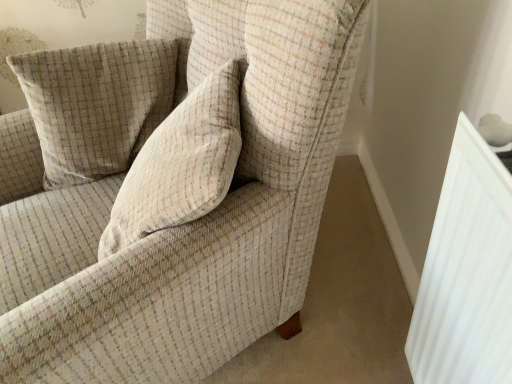
Question: Is beige textured cushion at upper left at the right side of white ribbed radiator at right?

Choices:
 (A) no
 (B) yes

Answer: (A)

Question: From the image's perspective, would you say beige textured cushion at upper left is positioned over white ribbed radiator at right?

Choices:
 (A) yes
 (B) no

Answer: (A)

Question: From the image's perspective, would you say beige textured cushion at upper left is shown under white ribbed radiator at right?

Choices:
 (A) no
 (B) yes

Answer: (A)

Question: Is beige textured cushion at upper left far away from white ribbed radiator at right?

Choices:
 (A) no
 (B) yes

Answer: (A)

Question: Considering the relative positions of beige textured cushion at upper left and white ribbed radiator at right in the image provided, is beige textured cushion at upper left to the left of white ribbed radiator at right from the viewer's perspective?

Choices:
 (A) yes
 (B) no

Answer: (A)

Question: Is beige textured cushion at upper left smaller than white ribbed radiator at right?

Choices:
 (A) no
 (B) yes

Answer: (A)

Question: From a real-world perspective, is white ribbed radiator at right beneath beige textured cushion at upper left?

Choices:
 (A) no
 (B) yes

Answer: (B)

Question: From a real-world perspective, is white ribbed radiator at right on beige textured cushion at upper left?

Choices:
 (A) yes
 (B) no

Answer: (B)

Question: Is white ribbed radiator at right shorter than beige textured cushion at upper left?

Choices:
 (A) no
 (B) yes

Answer: (A)

Question: Is white ribbed radiator at right oriented away from beige textured cushion at upper left?

Choices:
 (A) yes
 (B) no

Answer: (B)

Question: Does white ribbed radiator at right have a greater height compared to beige textured cushion at upper left?

Choices:
 (A) no
 (B) yes

Answer: (B)

Question: Is white ribbed radiator at right wider than beige textured cushion at upper left?

Choices:
 (A) yes
 (B) no

Answer: (B)

Question: Does beige textured cushion at upper left have a lesser width compared to textured beige armchair at center?

Choices:
 (A) no
 (B) yes

Answer: (B)